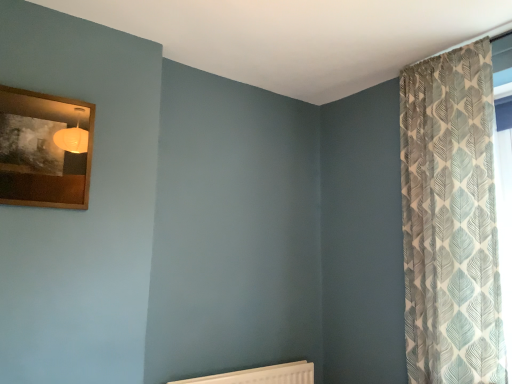
Question: Considering their positions, is patterned fabric curtain at right located in front of or behind wooden picture frame at upper left?

Choices:
 (A) behind
 (B) front

Answer: (A)

Question: In terms of height, does patterned fabric curtain at right look taller or shorter compared to wooden picture frame at upper left?

Choices:
 (A) tall
 (B) short

Answer: (A)

Question: Estimate the real-world distances between objects in this image. Which object is farther from the patterned fabric curtain at right?

Choices:
 (A) white textured radiator at lower center
 (B) wooden picture frame at upper left

Answer: (B)

Question: Considering the real-world distances, which object is farthest from the wooden picture frame at upper left?

Choices:
 (A) white textured radiator at lower center
 (B) patterned fabric curtain at right

Answer: (B)